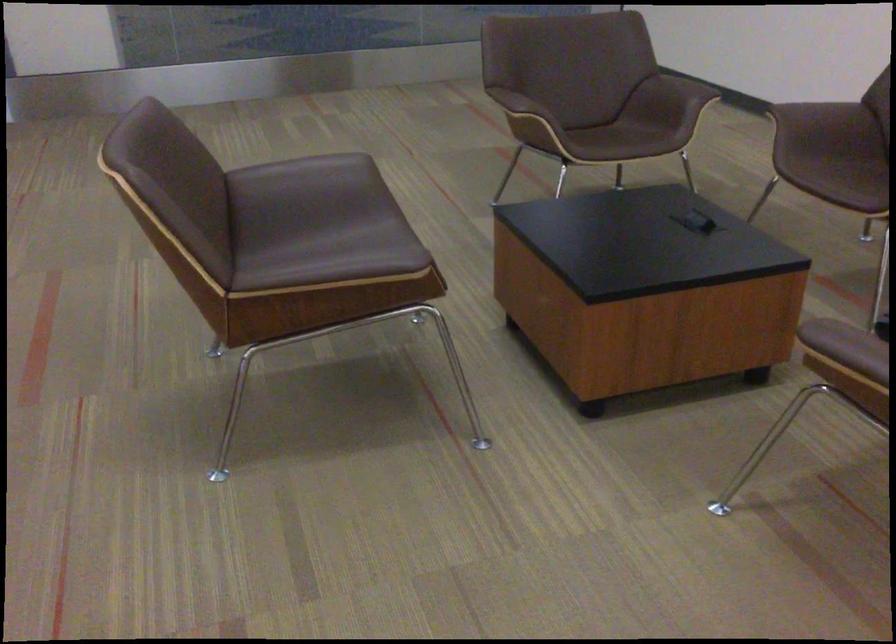
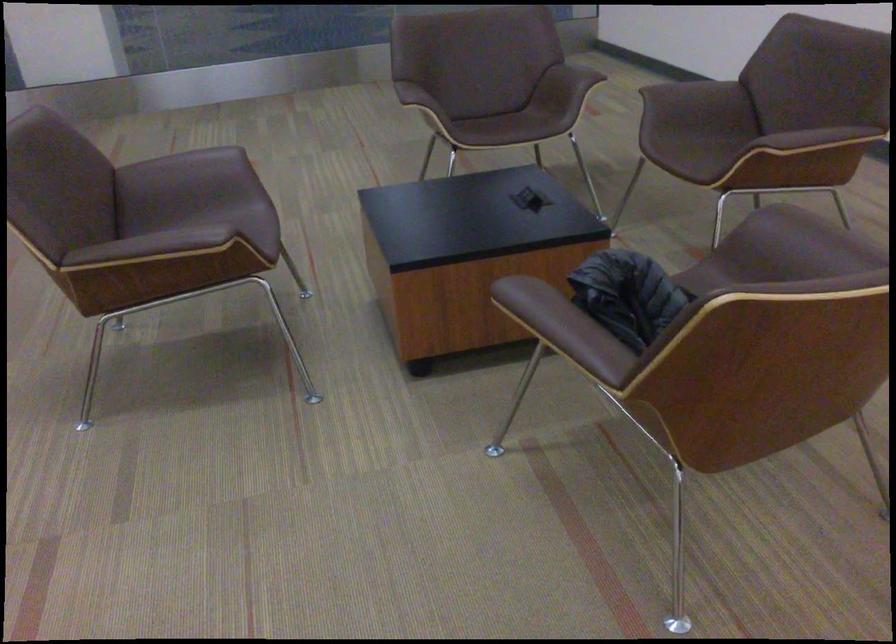
Question: The camera is either moving clockwise (left) or counter-clockwise (right) around the object. The first image is from the beginning of the video and the second image is from the end. Is the camera moving left or right when shooting the video?

Choices:
 (A) Left
 (B) Right

Answer: (B)